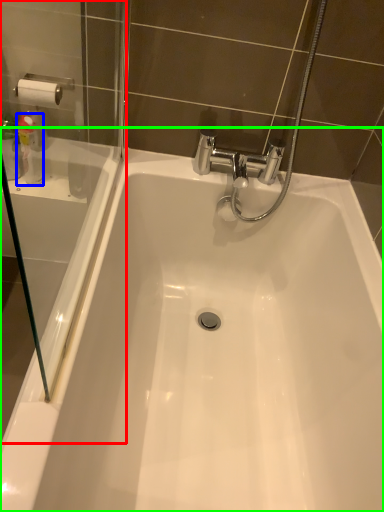
Question: Estimate the real-world distances between objects in this image. Which object is farther from screen door (highlighted by a red box), cleaning product (highlighted by a blue box) or bathtub (highlighted by a green box)?

Choices:
 (A) cleaning product
 (B) bathtub

Answer: (B)